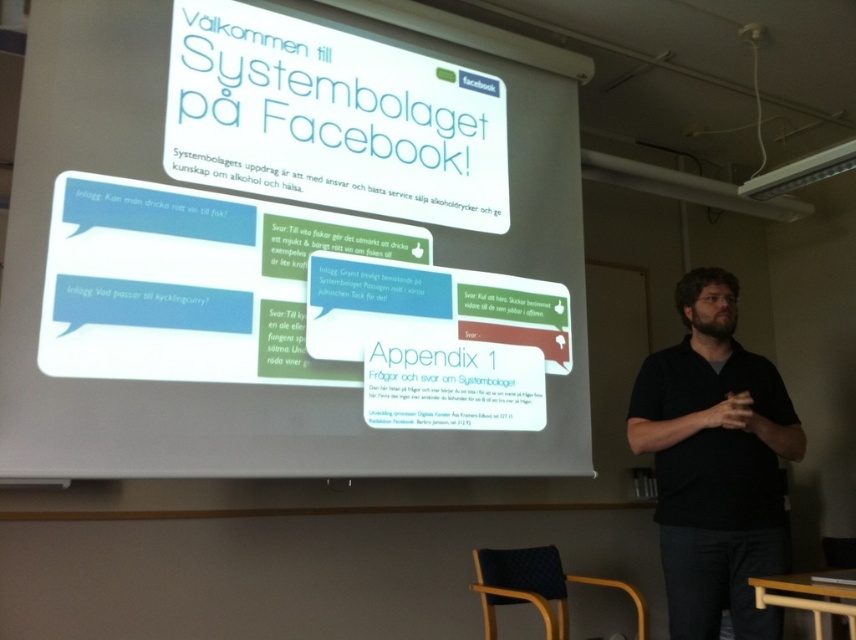
Is white paper at upper center thinner than black matte shirt at center?

No.

Which is behind, point (524, 260) or point (703, 618)?

The point (524, 260) is behind.

Which is in front, point (15, 268) or point (756, 476)?

Point (15, 268) is in front.

You are a GUI agent. You are given a task and a screenshot of the screen. Output one action in this format:
    pyautogui.click(x=<x>, y=<y>)
    Task: Click on the white paper at upper center
    
    Given the screenshot: What is the action you would take?
    pyautogui.click(x=292, y=244)

Based on the photo, is white paper at center behind black matte shirt at center?

That is True.

Who is more forward, (x=281, y=65) or (x=722, y=508)?

Point (x=722, y=508)

Between point (289, 195) and point (657, 420), which one is positioned behind?

Positioned behind is point (657, 420).

This screenshot has width=856, height=640. What are the coordinates of `white paper at center` in the screenshot? It's located at (331, 118).

Does white paper at upper center appear on the left side of white paper at center?

Incorrect, white paper at upper center is not on the left side of white paper at center.

Who is shorter, white paper at upper center or white paper at center?

Standing shorter between the two is white paper at center.

Is point (524, 138) less distant than point (504, 170)?

No, it is behind (504, 170).

Find the location of a particular element. This screenshot has width=856, height=640. white paper at upper center is located at coordinates (292, 244).